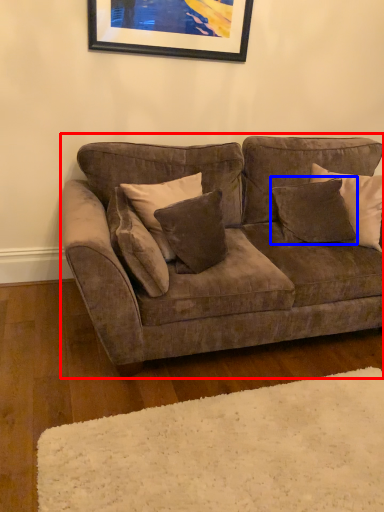
Question: Which of the following is the closest to the observer, studio couch (highlighted by a red box) or pillow (highlighted by a blue box)?

Choices:
 (A) studio couch
 (B) pillow

Answer: (A)